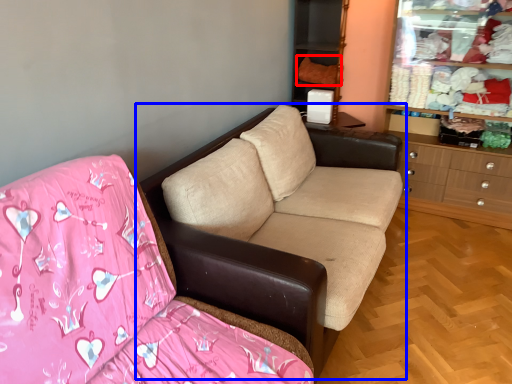
Question: Which object is closer to the camera taking this photo, clothing (highlighted by a red box) or studio couch (highlighted by a blue box)?

Choices:
 (A) clothing
 (B) studio couch

Answer: (B)